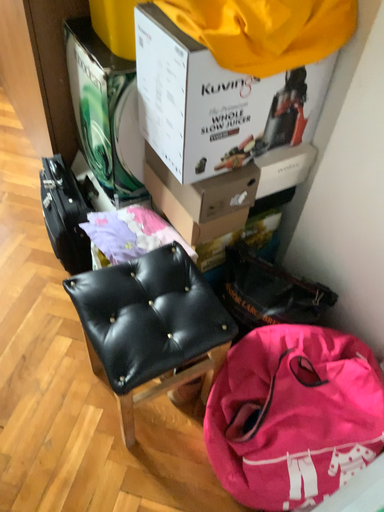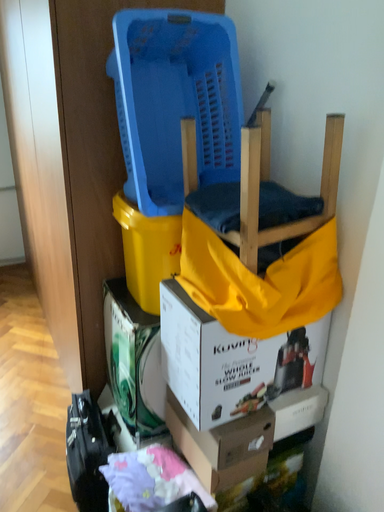
Question: Which way did the camera rotate in the video?

Choices:
 (A) rotated downward
 (B) rotated upward

Answer: (B)